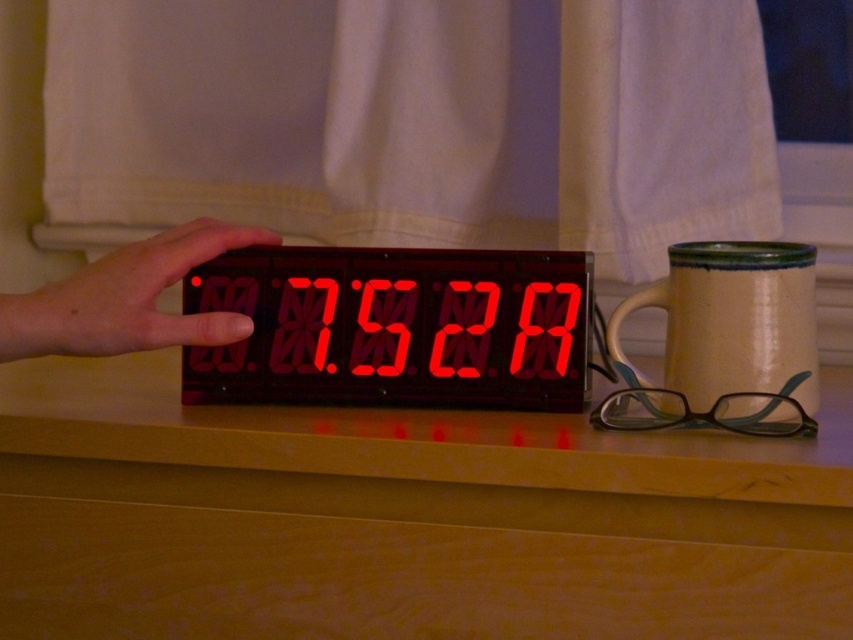
You are trying to locate the red led display at center in the image. What are the coordinates of its position?

The red led display at center is located at coordinates point (395, 326).

From the picture: You are organizing items on a desk and want to place both the red led display at center and the matte ceramic mug at right. Since the desk space is limited, you need to know which item takes up more horizontal space. Which object has a greater width?

The red led display at center has a larger width than the matte ceramic mug at right.